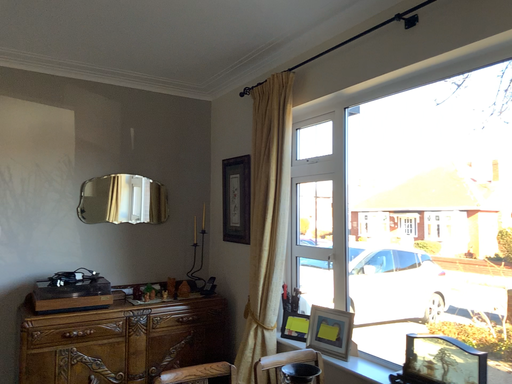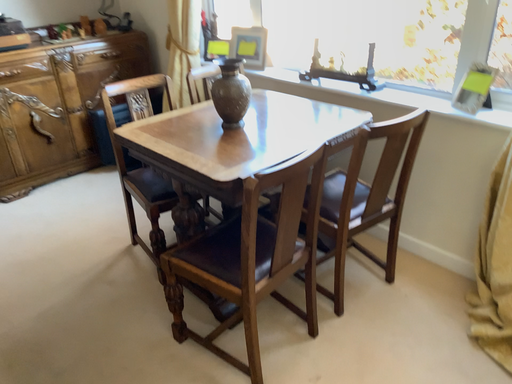
Question: How did the camera likely rotate when shooting the video?

Choices:
 (A) rotated downward
 (B) rotated upward

Answer: (A)